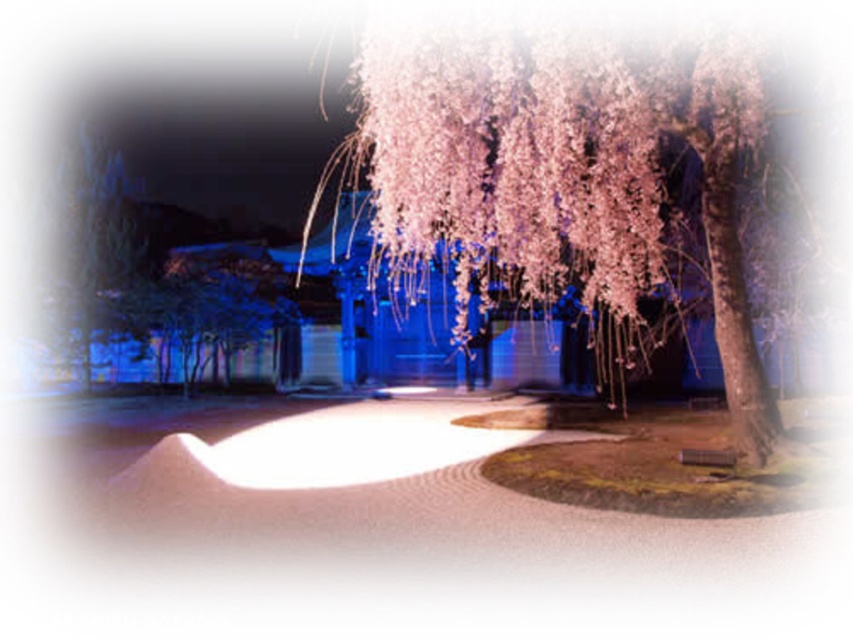
You are an artist planning to sketch this scene. You want to ensure the pink blossoms at center and the smooth gray stone wall at left are positioned correctly. Based on the scene, which object is located to the right of the other?

The pink blossoms at center are to the right of the smooth gray stone wall at left.

You are standing in the nighttime scene and want to determine the relative positions of two points in the image. Which point is closer to you, point (x=379, y=112) or point (x=79, y=272)?

→ Point (x=379, y=112) is closer to the viewer than point (x=79, y=272).

You are standing in the nighttime scene and want to take a photo of the pink blossoms at center. Where exactly should you aim your camera to capture them?

You should aim your camera at point 0.263 on the horizontal axis and 0.655 on the vertical axis to capture the pink blossoms at center.